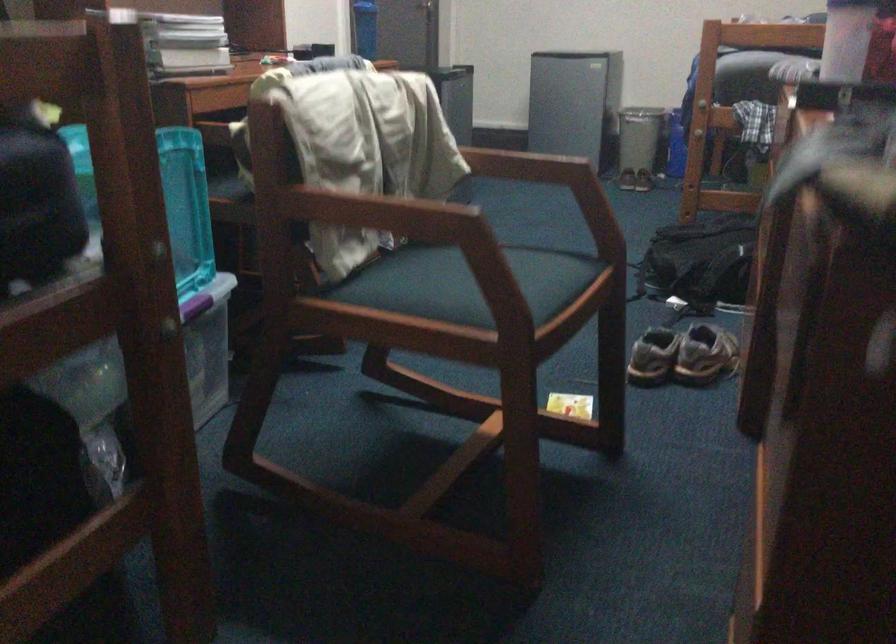
Find the location of a particular element. The image size is (896, 644). wooden chair armrest is located at coordinates (436, 210).